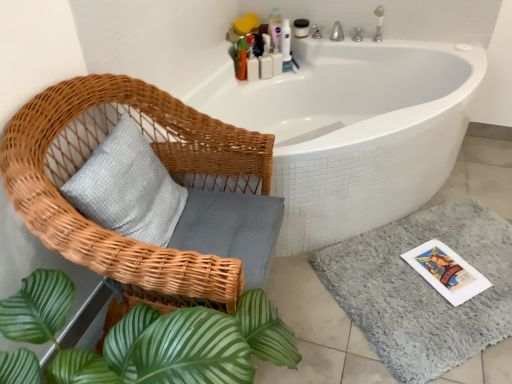
I want to click on free spot to the right of silver metallic tap at upper right, so click(384, 41).